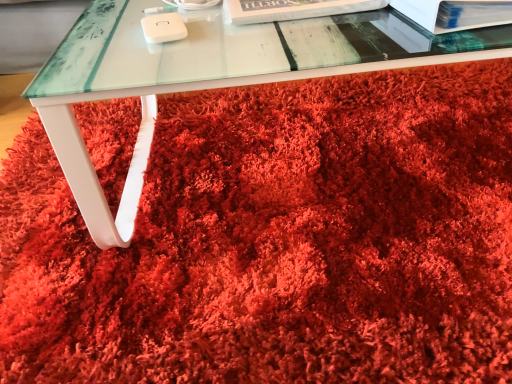
Question: From the image's perspective, does white paper at upper center, arranged as the second paperback book when viewed from the right, appear lower than white glossy paperback book at upper right, acting as the first paperback book starting from the right?

Choices:
 (A) yes
 (B) no

Answer: (B)

Question: Considering the relative positions of white paper at upper center, arranged as the second paperback book when viewed from the right, and white glossy paperback book at upper right, acting as the first paperback book starting from the right, in the image provided, is white paper at upper center, arranged as the second paperback book when viewed from the right, behind white glossy paperback book at upper right, acting as the first paperback book starting from the right,?

Choices:
 (A) yes
 (B) no

Answer: (A)

Question: Is white paper at upper center, which ranks as the first paperback book in left-to-right order, with white glossy paperback book at upper right, acting as the 2th paperback book starting from the left?

Choices:
 (A) yes
 (B) no

Answer: (B)

Question: Is white paper at upper center, which ranks as the first paperback book in left-to-right order, closer to camera compared to white glossy paperback book at upper right, acting as the 2th paperback book starting from the left?

Choices:
 (A) yes
 (B) no

Answer: (B)

Question: Considering the relative sizes of white paper at upper center, arranged as the second paperback book when viewed from the right, and white glossy paperback book at upper right, acting as the 2th paperback book starting from the left, in the image provided, is white paper at upper center, arranged as the second paperback book when viewed from the right, bigger than white glossy paperback book at upper right, acting as the 2th paperback book starting from the left,?

Choices:
 (A) yes
 (B) no

Answer: (B)

Question: Is point (144, 67) closer or farther from the camera than point (313, 11)?

Choices:
 (A) closer
 (B) farther

Answer: (A)

Question: Considering the positions of transparent glass table at center and white paper at upper center, arranged as the second paperback book when viewed from the right, in the image, is transparent glass table at center bigger or smaller than white paper at upper center, arranged as the second paperback book when viewed from the right,?

Choices:
 (A) big
 (B) small

Answer: (A)

Question: Would you say transparent glass table at center is inside or outside white paper at upper center, which ranks as the first paperback book in left-to-right order?

Choices:
 (A) inside
 (B) outside

Answer: (B)

Question: From a real-world perspective, is transparent glass table at center physically located above or below white paper at upper center, arranged as the second paperback book when viewed from the right?

Choices:
 (A) below
 (B) above

Answer: (A)

Question: Looking at their shapes, would you say white glossy paperback book at upper right, acting as the 2th paperback book starting from the left, is wider or thinner than transparent glass table at center?

Choices:
 (A) thin
 (B) wide

Answer: (A)

Question: Considering the positions of white glossy paperback book at upper right, acting as the 2th paperback book starting from the left, and transparent glass table at center in the image, is white glossy paperback book at upper right, acting as the 2th paperback book starting from the left, taller or shorter than transparent glass table at center?

Choices:
 (A) short
 (B) tall

Answer: (B)

Question: In the image, is white glossy paperback book at upper right, acting as the 2th paperback book starting from the left, positioned in front of or behind transparent glass table at center?

Choices:
 (A) front
 (B) behind

Answer: (B)

Question: Which is correct: white glossy paperback book at upper right, acting as the first paperback book starting from the right, is inside transparent glass table at center, or outside of it?

Choices:
 (A) inside
 (B) outside

Answer: (B)

Question: Is white glossy paperback book at upper right, acting as the first paperback book starting from the right, inside or outside of white paper at upper center, which ranks as the first paperback book in left-to-right order?

Choices:
 (A) outside
 (B) inside

Answer: (A)

Question: From a real-world perspective, relative to white paper at upper center, arranged as the second paperback book when viewed from the right, is white glossy paperback book at upper right, acting as the first paperback book starting from the right, vertically above or below?

Choices:
 (A) above
 (B) below

Answer: (A)